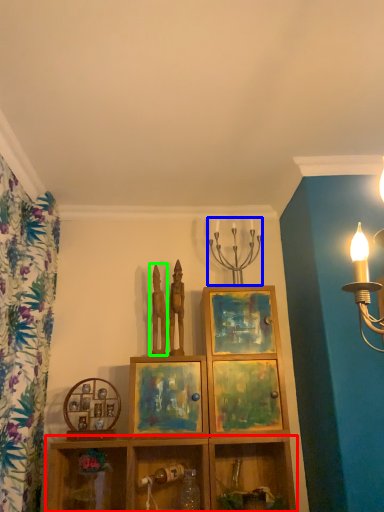
Question: Based on their relative distances, which object is nearer to shelf (highlighted by a red box)? Choose from candle holder (highlighted by a blue box) and sculpture (highlighted by a green box).

Choices:
 (A) candle holder
 (B) sculpture

Answer: (B)